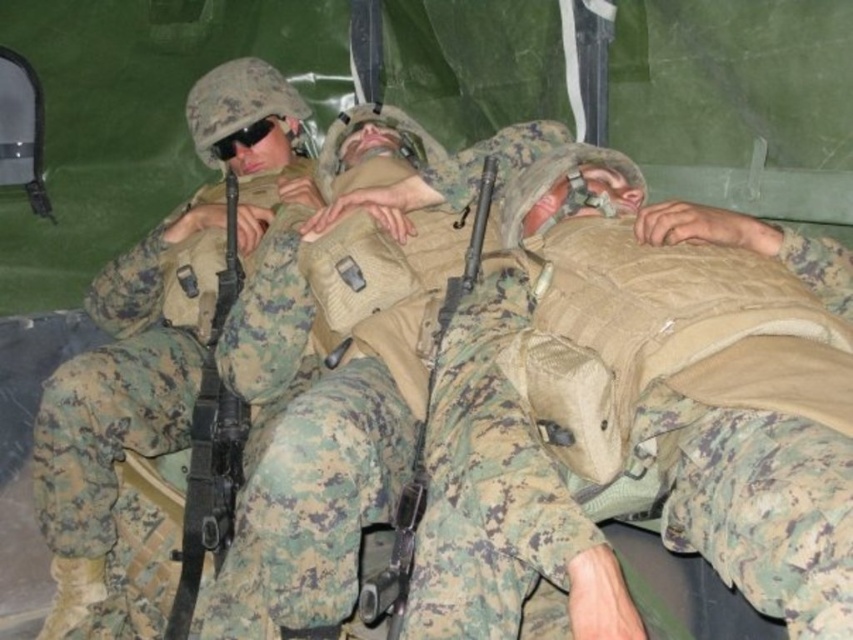
Between matte black rifle at left and black matte goggles at upper center, which one is positioned higher?

Positioned higher is black matte goggles at upper center.

From the picture: Does matte black rifle at left have a lesser width compared to black matte goggles at upper center?

Yes, matte black rifle at left is thinner than black matte goggles at upper center.

What do you see at coordinates (212, 445) in the screenshot?
I see `matte black rifle at left` at bounding box center [212, 445].

The image size is (853, 640). I want to click on matte black rifle at left, so click(x=212, y=445).

Who is shorter, camouflage uniform at left or matte black rifle at center?

Standing shorter between the two is matte black rifle at center.

Who is taller, camouflage uniform at left or matte black rifle at center?

camouflage uniform at left is taller.

Who is more forward, (216, 72) or (405, 541)?

Point (405, 541)

Find the location of `camouflage uniform at left`. camouflage uniform at left is located at coordinates (122, 397).

Is the position of camouflage uniform at left more distant than that of matte black rifle at left?

No, camouflage uniform at left is in front of matte black rifle at left.

Between camouflage uniform at left and matte black rifle at left, which one has less height?

Standing shorter between the two is matte black rifle at left.

Does point (61, 417) come in front of point (190, 509)?

Yes, it is.

At what (x,y) coordinates should I click in order to perform the action: click on camouflage uniform at left. Please return your answer as a coordinate pair (x, y). The width and height of the screenshot is (853, 640). Looking at the image, I should click on (122, 397).